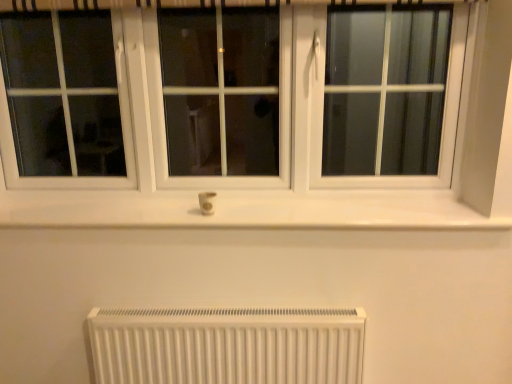
Question: Is white plastic electric outlet at center behind white matte radiator at lower center?

Choices:
 (A) yes
 (B) no

Answer: (A)

Question: Is white plastic electric outlet at center not close to white matte radiator at lower center?

Choices:
 (A) yes
 (B) no

Answer: (B)

Question: Does white plastic electric outlet at center have a lesser width compared to white matte radiator at lower center?

Choices:
 (A) yes
 (B) no

Answer: (A)

Question: Does white plastic electric outlet at center have a smaller size compared to white matte radiator at lower center?

Choices:
 (A) yes
 (B) no

Answer: (A)

Question: Can you confirm if white plastic electric outlet at center is taller than white matte radiator at lower center?

Choices:
 (A) yes
 (B) no

Answer: (B)

Question: Does white plastic electric outlet at center appear on the left side of white matte radiator at lower center?

Choices:
 (A) no
 (B) yes

Answer: (B)

Question: Is white matte radiator at lower center far away from white plastic electric outlet at center?

Choices:
 (A) no
 (B) yes

Answer: (A)

Question: Is white matte radiator at lower center oriented towards white plastic electric outlet at center?

Choices:
 (A) yes
 (B) no

Answer: (B)

Question: Is white matte radiator at lower center positioned in front of white plastic electric outlet at center?

Choices:
 (A) no
 (B) yes

Answer: (B)

Question: Does white matte radiator at lower center have a lesser width compared to white plastic electric outlet at center?

Choices:
 (A) yes
 (B) no

Answer: (B)

Question: From the image's perspective, would you say white matte radiator at lower center is positioned over white plastic electric outlet at center?

Choices:
 (A) yes
 (B) no

Answer: (B)

Question: Can you confirm if white matte radiator at lower center is positioned to the left of white plastic electric outlet at center?

Choices:
 (A) no
 (B) yes

Answer: (A)

Question: From their relative heights in the image, would you say white plastic electric outlet at center is taller or shorter than white matte radiator at lower center?

Choices:
 (A) short
 (B) tall

Answer: (A)